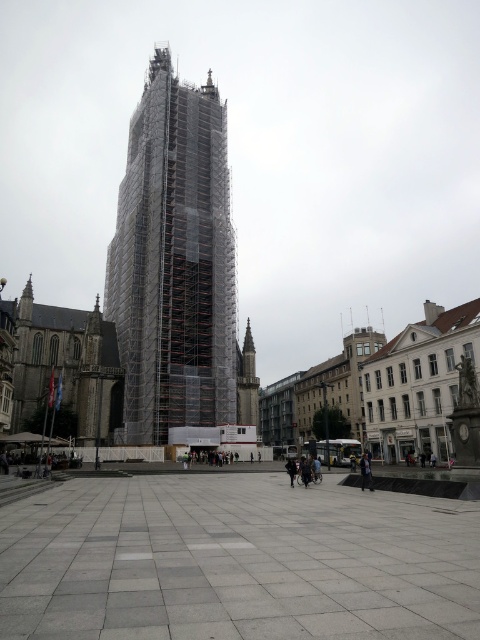
You are a delivery person trying to deliver a package to the dark blue fabric jacket at lower right. You are currently standing next to the black leather jacket at lower center. The delivery robot you are using has a maximum range of 10 meters. Can the robot successfully deliver the package to the jacket?

The dark blue fabric jacket at lower right and the black leather jacket at lower center are 9.90 meters apart from each other. Since the robot has a maximum range of 10 meters, it can successfully deliver the package as the distance is within the robot s range.

Consider the image. You are a delivery driver who needs to park your truck, which is 3 meters wide, on the gray concrete pavement at center. Can you park your truck there without overlapping the scaffolding at center?

The gray concrete pavement at center has a larger width than the scaffolding at center. Since the truck is 3 meters wide, it can be parked on the gray concrete pavement at center without overlapping the scaffolding at center as there is sufficient space.